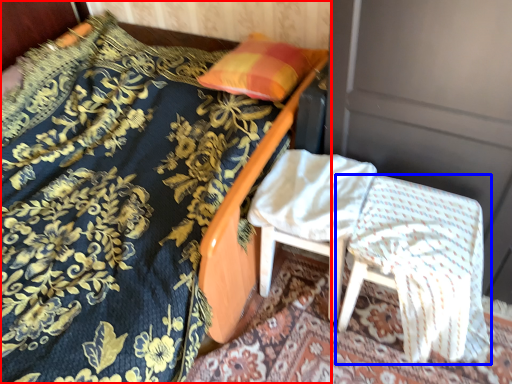
Question: Which object is closer to the camera taking this photo, bed (highlighted by a red box) or chair (highlighted by a blue box)?

Choices:
 (A) bed
 (B) chair

Answer: (A)